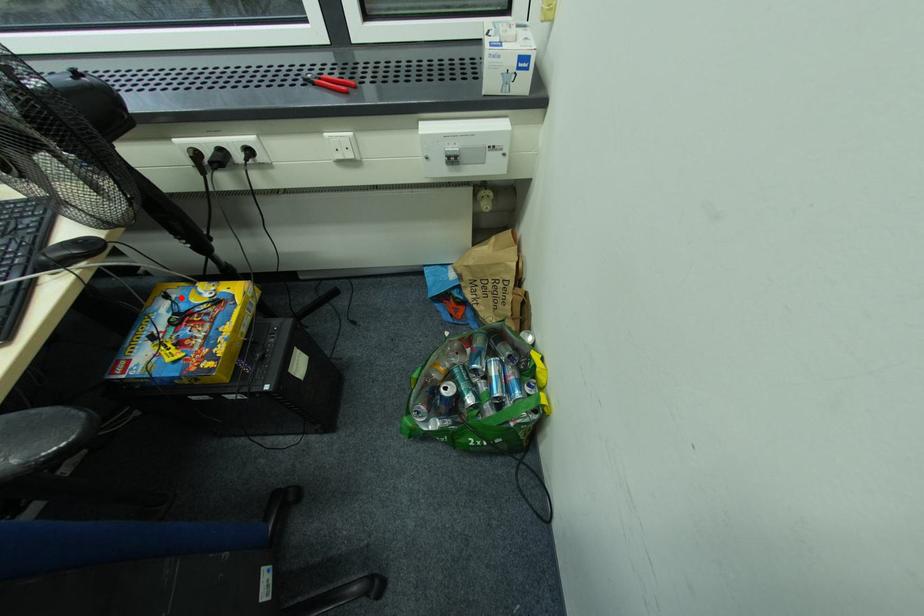
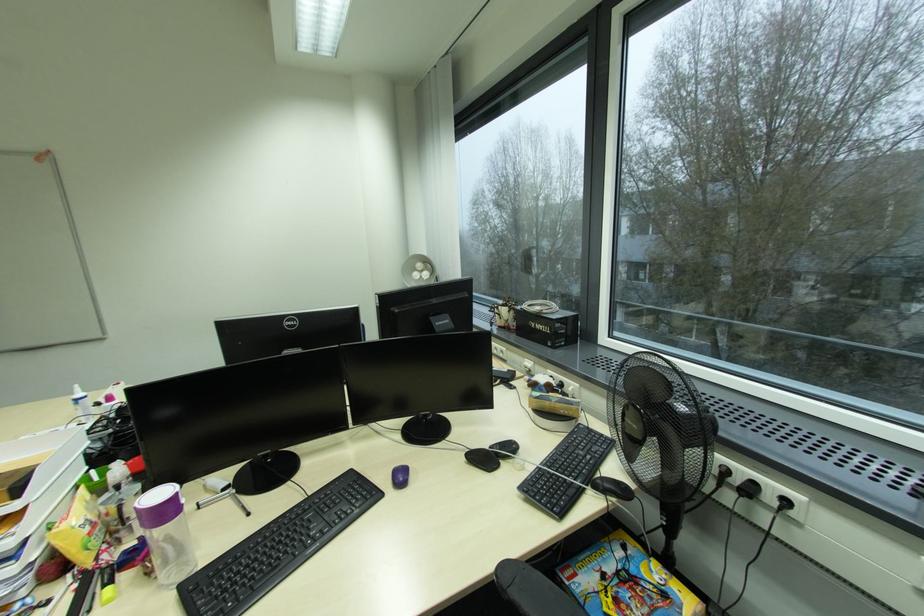
Locate, in the second image, the point that corresponds to the highlighted location in the first image.

(637, 554)